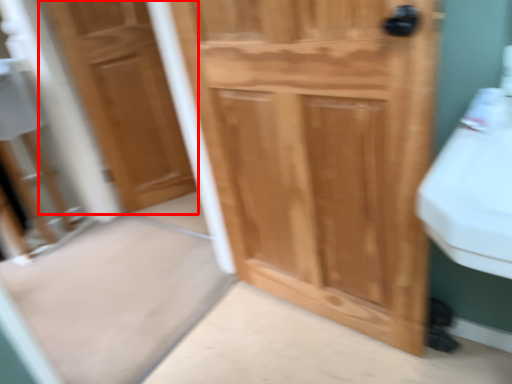
Question: From the image's perspective, what is the correct spatial positioning of door (annotated by the red box) in reference to door?

Choices:
 (A) below
 (B) above

Answer: (B)